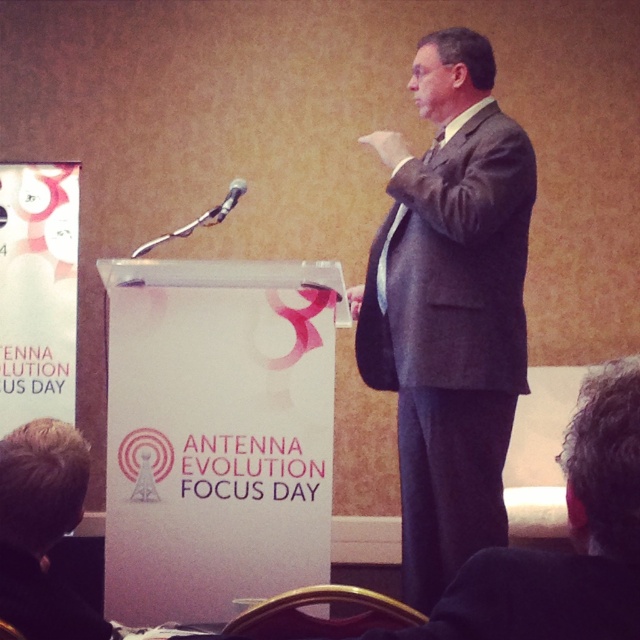
Question: Among these objects, which one is nearest to the camera?

Choices:
 (A) matte gray suit at center
 (B) black plastic microphone at upper center

Answer: (A)

Question: Can you confirm if matte gray suit at center is bigger than black plastic microphone at upper center?

Choices:
 (A) no
 (B) yes

Answer: (B)

Question: Where is matte gray suit at center located in relation to black plastic microphone at upper center in the image?

Choices:
 (A) left
 (B) right

Answer: (B)

Question: Is matte gray suit at center wider than black plastic microphone at upper center?

Choices:
 (A) no
 (B) yes

Answer: (B)